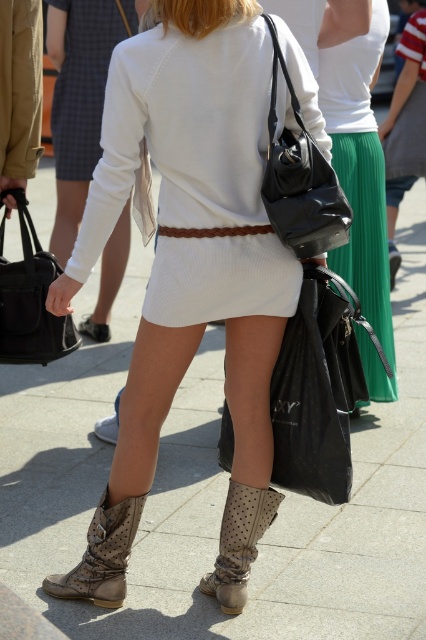
You are a fashion designer observing the scene. You need to determine which item has a greater width between the green pleated skirt at upper center and the matte black handbag at left. Which one is wider?

The green pleated skirt at upper center is wider than the matte black handbag at left according to the description.

You are a fashion designer observing the scene. You need to decide which item, the leather boots at lower center or the black matte bag at center, requires more material to produce. Based on their sizes in the image, which one would you choose?

The leather boots at lower center is bigger than the black matte bag at center, so the leather boots at lower center would require more material to produce.